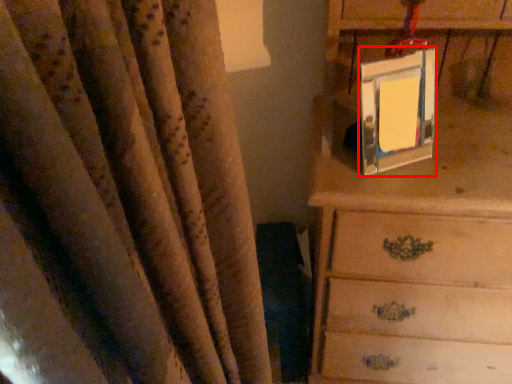
Question: From the image's perspective, what is the correct spatial positioning of picture frame (annotated by the red box) in reference to chest of drawers?

Choices:
 (A) above
 (B) below

Answer: (A)